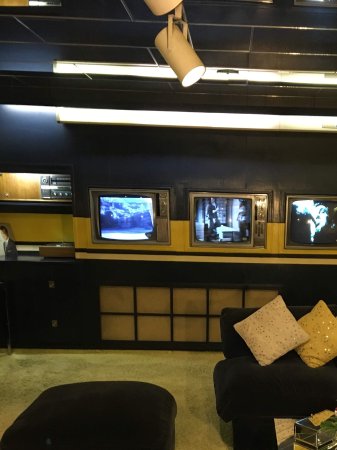
Locate an element on the screen. This screenshot has height=450, width=337. throw pillow is located at coordinates (271, 333), (323, 329).